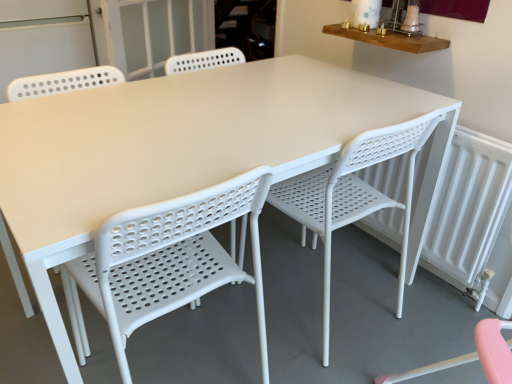
You are a GUI agent. You are given a task and a screenshot of the screen. Output one action in this format:
    pyautogui.click(x=<x>, y=<y>)
    Task: Click on the vacant space positioned to the left of white plastic radiator at right
    The image size is (512, 384).
    Given the screenshot: What is the action you would take?
    pyautogui.click(x=333, y=272)